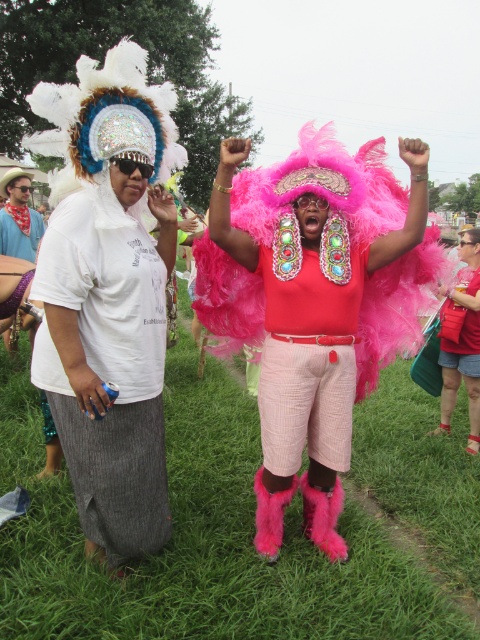
Is matte pink feather boa at center to the right of pink feather boa at center from the viewer's perspective?

Indeed, matte pink feather boa at center is positioned on the right side of pink feather boa at center.

Does matte pink feather boa at center appear over pink feather boa at center?

Incorrect, matte pink feather boa at center is not positioned above pink feather boa at center.

Locate an element on the screen. Image resolution: width=480 pixels, height=640 pixels. matte pink feather boa at center is located at coordinates (462, 340).

Locate an element on the screen. The width and height of the screenshot is (480, 640). matte pink feather boa at center is located at coordinates (462, 340).

Between white textured skirt at left and brushed metal water at bottle left, which one is positioned higher?

Positioned higher is brushed metal water at bottle left.

Is white textured skirt at left positioned in front of brushed metal water at bottle left?

That is True.

The image size is (480, 640). I want to click on white textured skirt at left, so pos(108,371).

Locate an element on the screen. The image size is (480, 640). white textured skirt at left is located at coordinates (108, 371).

Consider the image. Is brushed metal water at bottle left below pink feather boa at center?

No.

Does point (8, 208) come farther from viewer compared to point (445, 301)?

Yes, it is.

Does point (17, 243) lie in front of point (470, 324)?

No, it is not.

Locate an element on the screen. This screenshot has width=480, height=640. brushed metal water at bottle left is located at coordinates (19, 216).